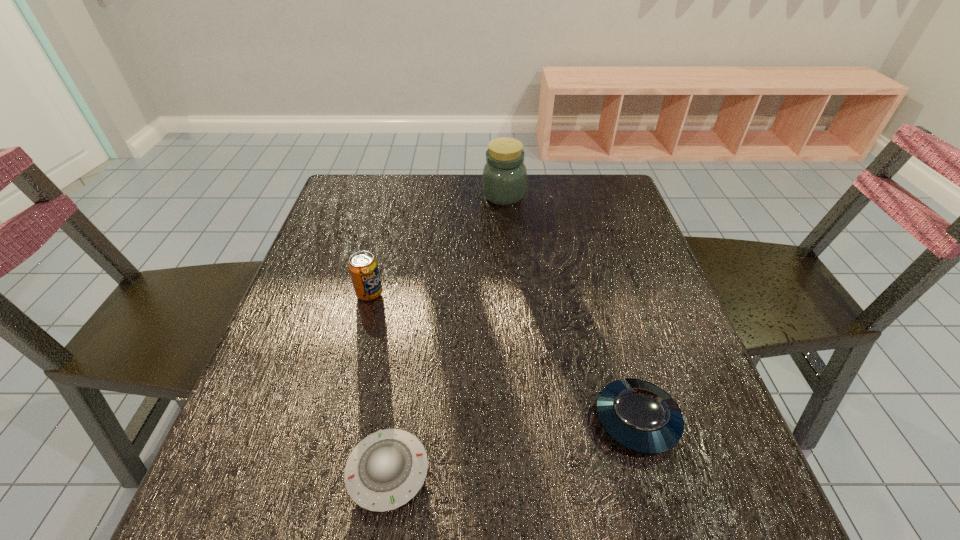
You are a GUI agent. You are given a task and a screenshot of the screen. Output one action in this format:
    pyautogui.click(x=<x>, y=<y>)
    Task: Click on the free region located on the back of the taller saucer
    The image size is (960, 540).
    Given the screenshot: What is the action you would take?
    pyautogui.click(x=618, y=355)

Where is `free space located on the back of the second object from left to right`? free space located on the back of the second object from left to right is located at coordinates (406, 350).

I want to click on object that is at the far edge, so click(x=504, y=179).

Where is `object at the near edge`? This screenshot has height=540, width=960. object at the near edge is located at coordinates (386, 469).

I want to click on object that is at the left edge, so click(x=363, y=267).

Locate an element on the screen. The height and width of the screenshot is (540, 960). object positioned at the right edge is located at coordinates (640, 416).

In the image, there is a desktop. What are the coordinates of `free space at the far edge` in the screenshot? It's located at (398, 197).

In the image, there is a desktop. Where is `vacant space at the near edge`? This screenshot has width=960, height=540. vacant space at the near edge is located at coordinates (533, 511).

Where is `blank area at the left edge`? The width and height of the screenshot is (960, 540). blank area at the left edge is located at coordinates (295, 282).

Where is `free space at the right edge of the desktop`? The image size is (960, 540). free space at the right edge of the desktop is located at coordinates (623, 377).